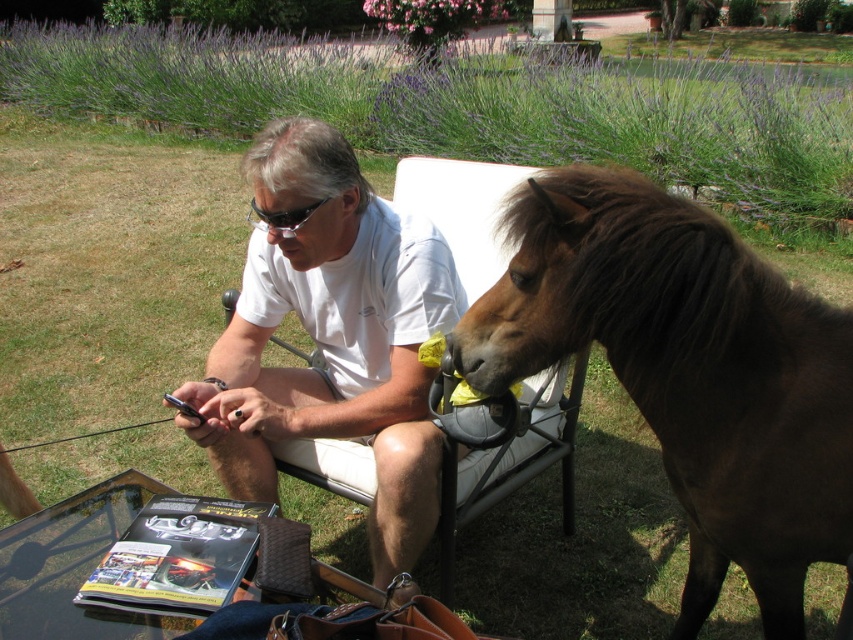
You are a photographer taking a picture of the man in the scene. You notice the white cotton shirt at center and the black plastic goggles at center. Which item should you adjust to ensure the goggles are visible in the photo?

The white cotton shirt at center is below the black plastic goggles at center. To ensure the goggles are visible, you should adjust the white cotton shirt at center so it doesn t block the goggles.

You are a delivery person who needs to place a package on the glass table. The package is 10 inches wide. The table has a brown glossy horse at right and black plastic goggles at center. Can you fit the package between them?

The brown glossy horse at right might be wider than black plastic goggles at center, so the package may not fit between them if the distance is less than 10 inches.